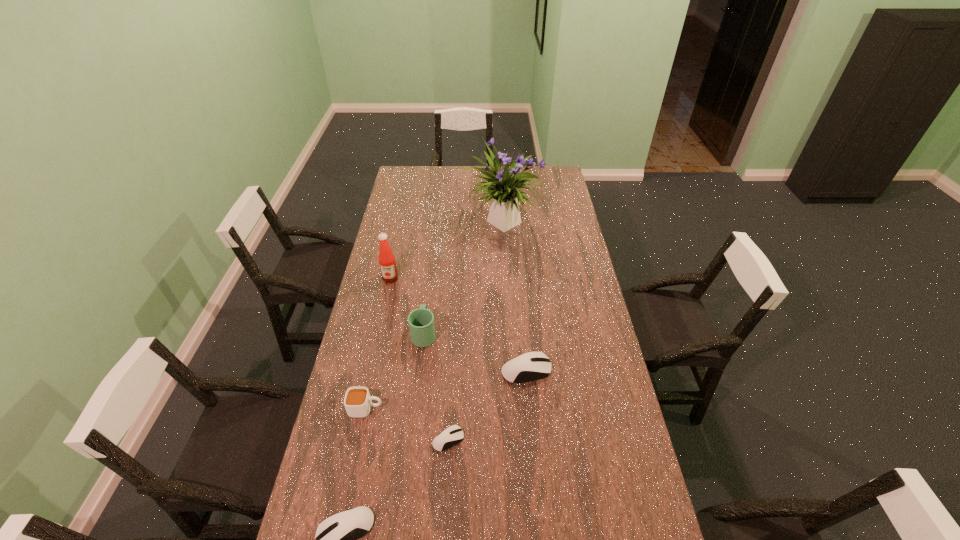
The image size is (960, 540). Identify the location of condiment located in the left edge section of the desktop. (388, 268).

Identify the location of cup situated at the left edge. This screenshot has height=540, width=960. (357, 401).

The image size is (960, 540). Find the location of `vacant area at the near edge`. vacant area at the near edge is located at coordinates (408, 524).

Locate an element on the screen. vacant area at the left edge is located at coordinates (378, 386).

Locate an element on the screen. free space at the right edge is located at coordinates coord(609,367).

Where is `free space at the far left corner of the desktop`? Image resolution: width=960 pixels, height=540 pixels. free space at the far left corner of the desktop is located at coordinates (399, 185).

Image resolution: width=960 pixels, height=540 pixels. What are the coordinates of `free location at the far right corner` in the screenshot? It's located at (537, 187).

Identify the location of free space between the cup and the second farthest object. (378, 343).

The image size is (960, 540). In order to click on vacant area between the farthest mouse and the sixth nearest object in this screenshot , I will do point(458,325).

Identify the location of free spot between the mug and the condiment. tap(407, 306).